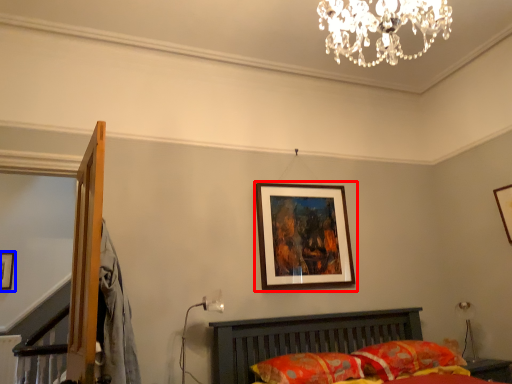
Question: Which object is further to the camera taking this photo, picture frame (highlighted by a red box) or picture frame (highlighted by a blue box)?

Choices:
 (A) picture frame
 (B) picture frame

Answer: (B)